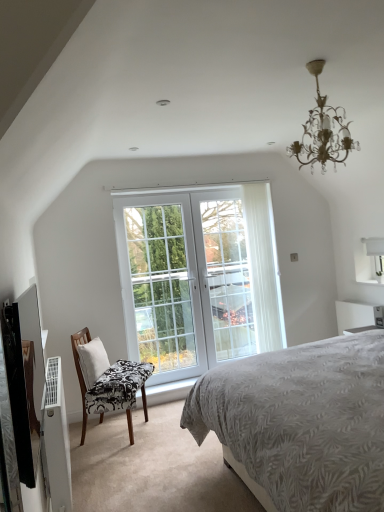
Locate an element on the screen. free location to the right of black and white patterned fabric chair at lower left is located at coordinates (160, 428).